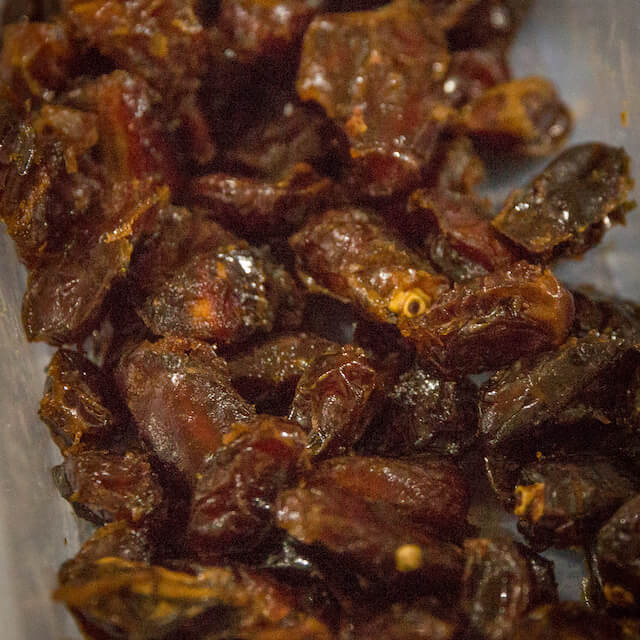
At what (x,y) coordinates should I click in order to perform the action: click on picture. Please return your answer as a coordinate pair (x, y). Looking at the image, I should click on (493, 523).